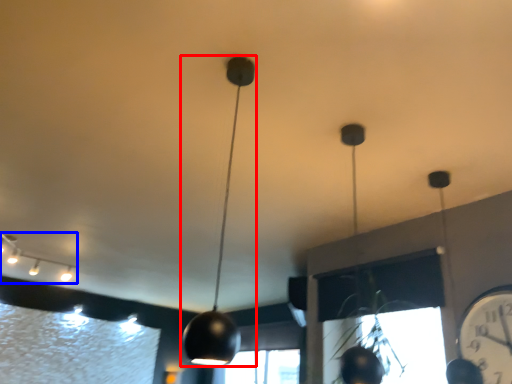
Question: Among these objects, which one is farthest to the camera, lamp (highlighted by a red box) or lamp (highlighted by a blue box)?

Choices:
 (A) lamp
 (B) lamp

Answer: (B)